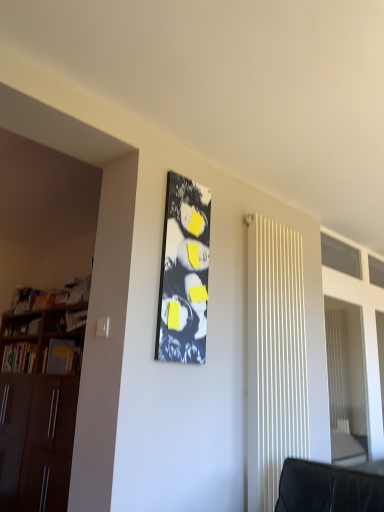
Question: From the image's perspective, is matte black bulletin board at center positioned above or below wooden at left?

Choices:
 (A) above
 (B) below

Answer: (A)

Question: Considering the relative positions of matte black bulletin board at center and wooden at left in the image provided, is matte black bulletin board at center to the left or to the right of wooden at left?

Choices:
 (A) left
 (B) right

Answer: (B)

Question: Based on their relative distances, which object is farther from the wooden at left?

Choices:
 (A) matte black bulletin board at center
 (B) white ribbed radiator at right
 (C) hardcover book at left

Answer: (B)

Question: Considering the real-world distances, which object is closest to the wooden at left?

Choices:
 (A) hardcover book at left
 (B) matte black bulletin board at center
 (C) white ribbed radiator at right

Answer: (A)